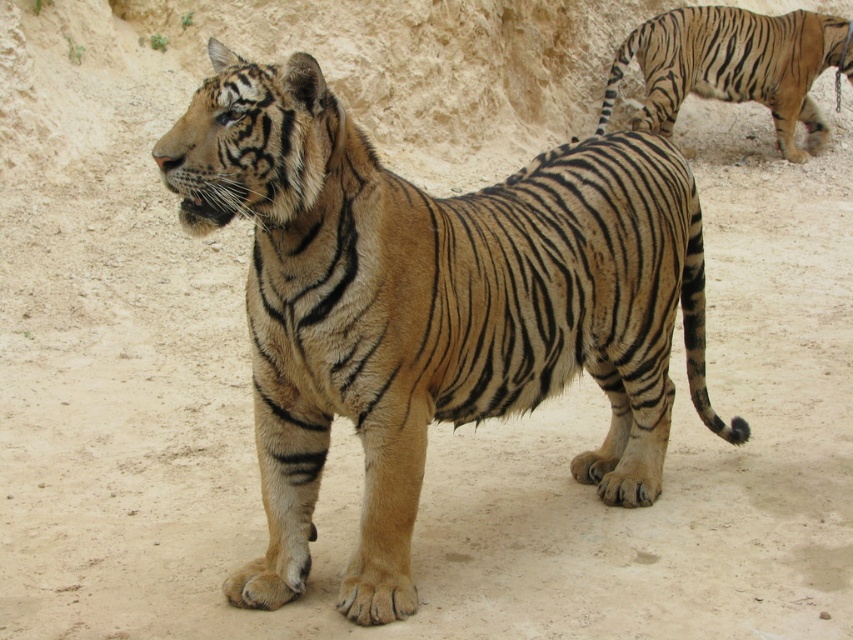
Measure the distance between golden fur tiger at center and striped fur tiger at upper right.

golden fur tiger at center is 24.10 feet from striped fur tiger at upper right.

Does golden fur tiger at center have a lesser height compared to striped fur tiger at upper right?

No, golden fur tiger at center is not shorter than striped fur tiger at upper right.

Which is behind, point (309, 154) or point (769, 19)?

Point (769, 19)

The width and height of the screenshot is (853, 640). Find the location of `golden fur tiger at center`. golden fur tiger at center is located at coordinates (431, 307).